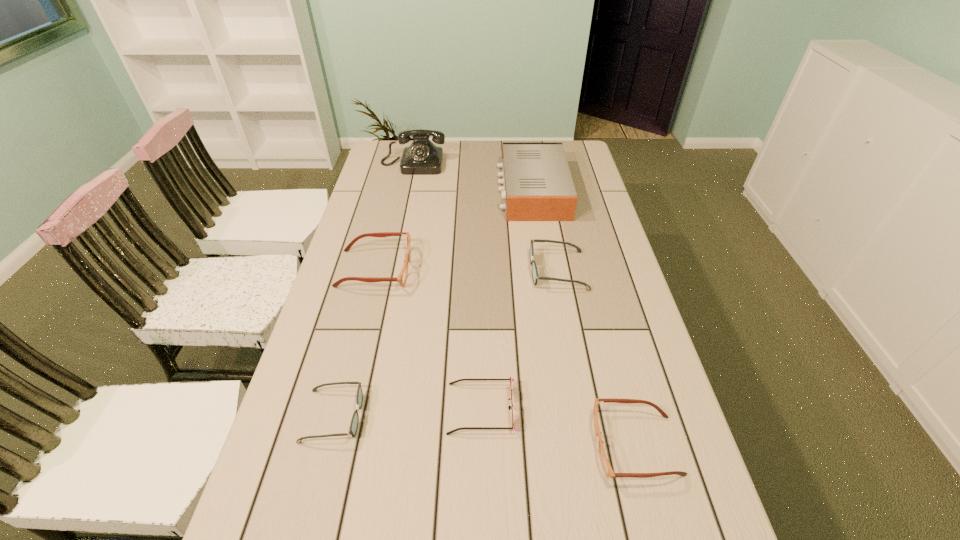
I want to click on the shortest spectacles, so click(x=352, y=431).

You are a GUI agent. You are given a task and a screenshot of the screen. Output one action in this format:
    pyautogui.click(x=<x>, y=<y>)
    Task: Click on the nearer gray spectacles
    The width and height of the screenshot is (960, 540).
    Given the screenshot: What is the action you would take?
    pyautogui.click(x=352, y=431)

In order to click on vacant space located on the dial of the tallest object in this screenshot , I will do `click(407, 192)`.

Identify the location of vacant space located on the control panel of the radio receiver. (427, 190).

Locate an element on the screen. Image resolution: width=960 pixels, height=540 pixels. free point located 0.120m on the control panel of the radio receiver is located at coordinates (467, 190).

Identify the location of vacant region located on the control panel of the radio receiver. The height and width of the screenshot is (540, 960). (398, 190).

This screenshot has height=540, width=960. In order to click on free space located on the front-facing side of the left brown spectacles in this screenshot , I will do `click(498, 269)`.

Identify the location of vacant space located on the face of the right gray spectacles. Image resolution: width=960 pixels, height=540 pixels. pos(468,271).

This screenshot has width=960, height=540. In order to click on vacant space situated on the face of the right gray spectacles in this screenshot , I will do `click(507, 271)`.

I want to click on free space located 0.320m on the face of the right gray spectacles, so click(x=426, y=271).